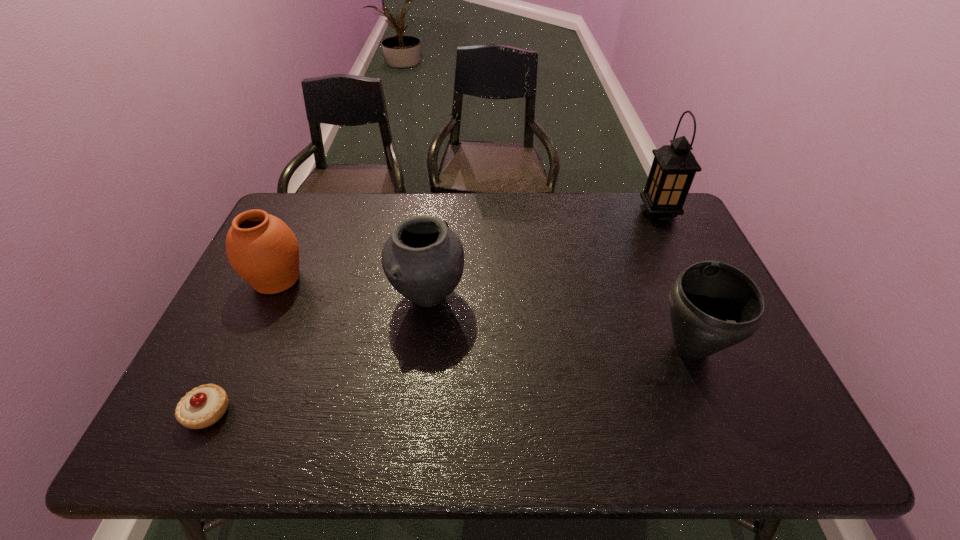
This screenshot has height=540, width=960. Find the location of `lantern`. lantern is located at coordinates pos(674,166).

Locate an element on the screen. the tallest object is located at coordinates (674, 166).

I want to click on the second urn from left to right, so coord(423,259).

I want to click on the rightmost urn, so click(x=713, y=305).

Identify the location of the leftmost urn. This screenshot has height=540, width=960. (261, 248).

The height and width of the screenshot is (540, 960). What are the coordinates of `the shortest object` in the screenshot? It's located at (203, 406).

Identify the location of the nearest object. (203, 406).

I want to click on vacant area situated 0.110m on the left of the lantern, so click(608, 213).

Identify the location of vacant space located on the left of the third object from left to right. (312, 296).

This screenshot has width=960, height=540. I want to click on vacant region located on the left of the rightmost urn, so click(x=553, y=348).